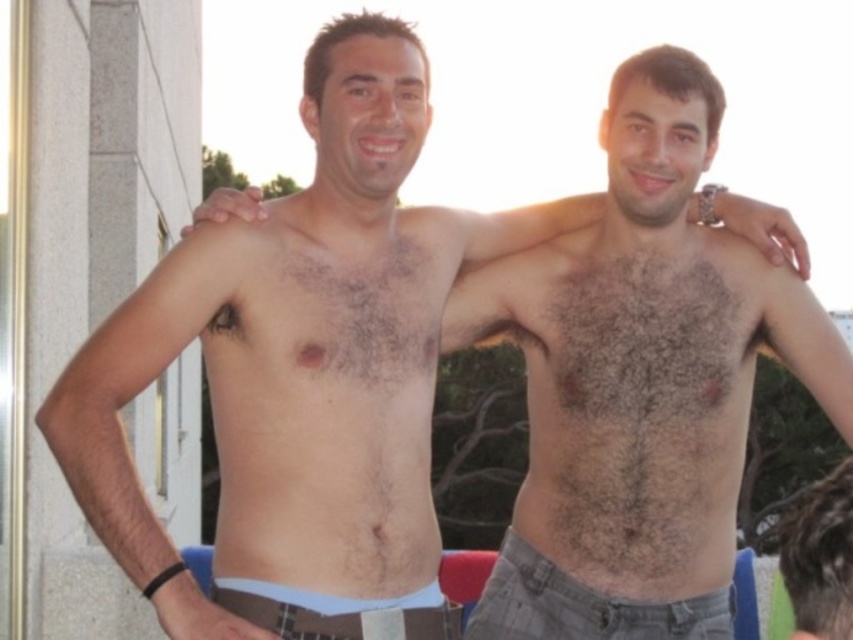
Who is shorter, white concrete pillar at left or brown hair at upper right?

brown hair at upper right

Between white concrete pillar at left and brown hair at upper right, which one appears on the right side from the viewer's perspective?

brown hair at upper right

This screenshot has width=853, height=640. Find the location of `white concrete pillar at left`. white concrete pillar at left is located at coordinates (106, 160).

Is gray fabric shorts at lower center taller than white fabric shorts at lower center?

Indeed, gray fabric shorts at lower center has a greater height compared to white fabric shorts at lower center.

Find the location of a particular element. The image size is (853, 640). gray fabric shorts at lower center is located at coordinates (583, 605).

Does dark brown hairy chest at center have a larger size compared to brown hair at upper right?

Actually, dark brown hairy chest at center might be smaller than brown hair at upper right.

Can you confirm if dark brown hairy chest at center is taller than brown hair at upper right?

Indeed, dark brown hairy chest at center has a greater height compared to brown hair at upper right.

The width and height of the screenshot is (853, 640). What do you see at coordinates (643, 419) in the screenshot? I see `dark brown hairy chest at center` at bounding box center [643, 419].

Find the location of `dark brown hairy chest at center`. dark brown hairy chest at center is located at coordinates (643, 419).